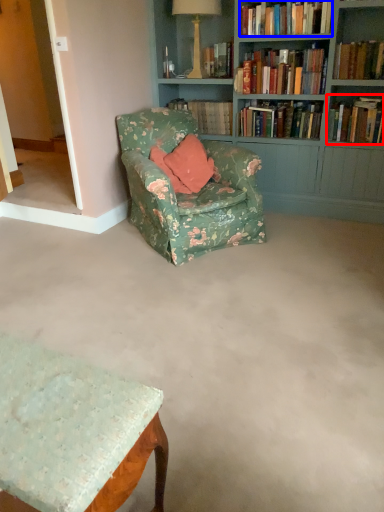
Question: Which point is further to the camera, book (highlighted by a red box) or book (highlighted by a blue box)?

Choices:
 (A) book
 (B) book

Answer: (A)